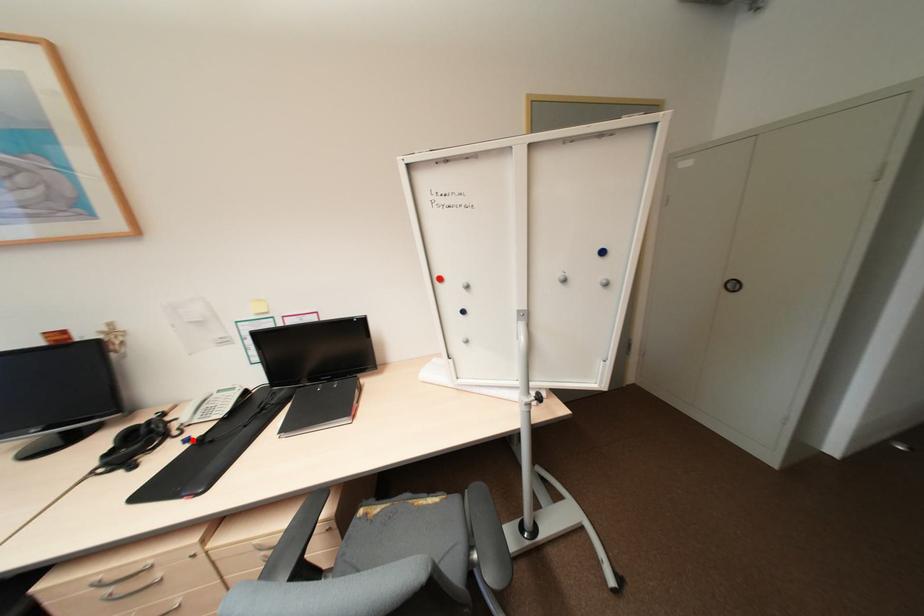
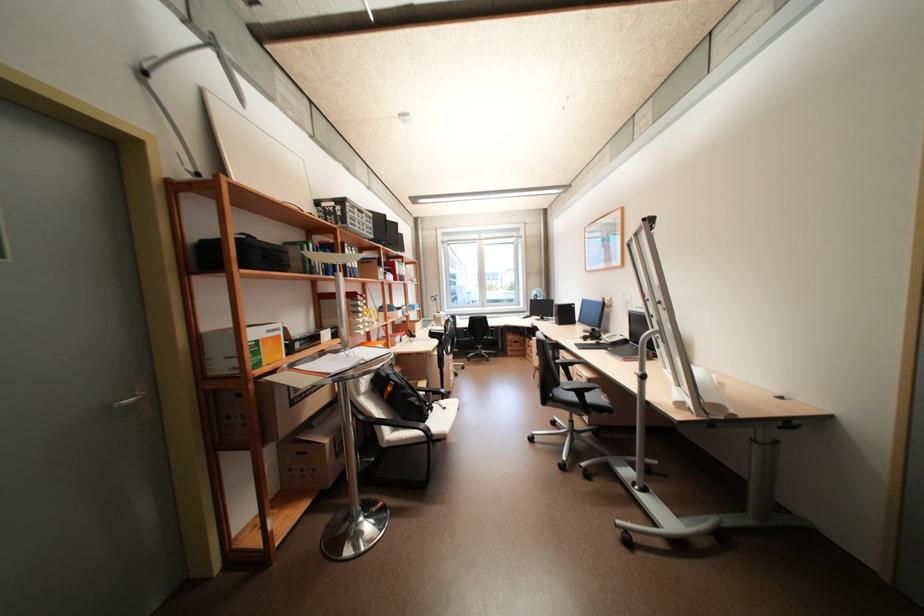
Find the pixel in the second image that matches the highlighted location in the first image.

(603, 342)